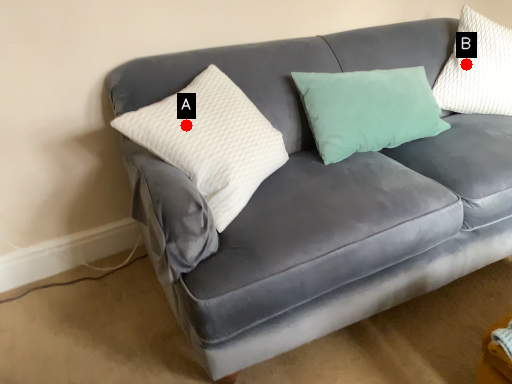
Question: Two points are circled on the image, labeled by A and B beside each circle. Which point is closer to the camera?

Choices:
 (A) A is closer
 (B) B is closer

Answer: (A)